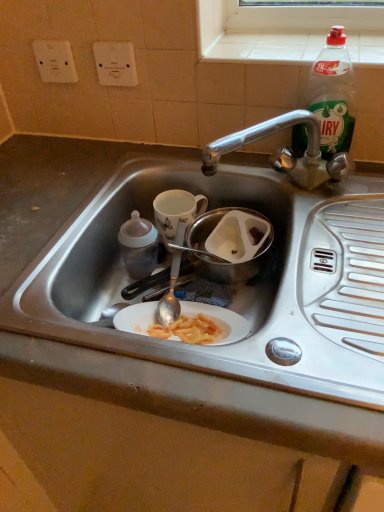
Question: Is white plastic socket at upper center, which is the first electric outlet in right-to-left order, positioned with its back to green plastic bottle at upper right, the first bottle in the right-to-left sequence?

Choices:
 (A) no
 (B) yes

Answer: (A)

Question: From the image's perspective, is white plastic socket at upper center, arranged as the 2th electric outlet when viewed from the left, located above green plastic bottle at upper right, the first bottle in the right-to-left sequence?

Choices:
 (A) no
 (B) yes

Answer: (B)

Question: From the image's perspective, does white plastic socket at upper center, which is the first electric outlet in right-to-left order, appear lower than green plastic bottle at upper right, the first bottle in the right-to-left sequence?

Choices:
 (A) no
 (B) yes

Answer: (A)

Question: Is white plastic socket at upper center, which is the first electric outlet in right-to-left order, oriented towards green plastic bottle at upper right, placed as the 2th bottle when sorted from bottom to top?

Choices:
 (A) no
 (B) yes

Answer: (A)

Question: Is white plastic socket at upper center, arranged as the 2th electric outlet when viewed from the left, shorter than green plastic bottle at upper right, which ranks as the first bottle in top-to-bottom order?

Choices:
 (A) no
 (B) yes

Answer: (B)

Question: From the image's perspective, is white plastic electric outlet at upper left, acting as the second electric outlet starting from the right, located above or below translucent plastic baby bottle at left, the 2th bottle when ordered from top to bottom?

Choices:
 (A) above
 (B) below

Answer: (A)

Question: Is white plastic electric outlet at upper left, which is the 1th electric outlet in left-to-right order, to the left or to the right of translucent plastic baby bottle at left, the 2th bottle viewed from the right, in the image?

Choices:
 (A) left
 (B) right

Answer: (A)

Question: Considering the positions of white plastic electric outlet at upper left, which is the 1th electric outlet in left-to-right order, and translucent plastic baby bottle at left, the 2th bottle when ordered from top to bottom, in the image, is white plastic electric outlet at upper left, which is the 1th electric outlet in left-to-right order, wider or thinner than translucent plastic baby bottle at left, the 2th bottle when ordered from top to bottom,?

Choices:
 (A) thin
 (B) wide

Answer: (A)

Question: From a real-world perspective, is white plastic electric outlet at upper left, acting as the second electric outlet starting from the right, positioned above or below translucent plastic baby bottle at left, the first bottle positioned from the bottom?

Choices:
 (A) below
 (B) above

Answer: (B)

Question: Relative to white plastic socket at upper center, which is the first electric outlet in right-to-left order, is metallic stainless steel bowl at center in front or behind?

Choices:
 (A) front
 (B) behind

Answer: (A)

Question: From a real-world perspective, is metallic stainless steel bowl at center physically located above or below white plastic socket at upper center, arranged as the 2th electric outlet when viewed from the left?

Choices:
 (A) below
 (B) above

Answer: (A)

Question: Is point (201, 223) closer or farther from the camera than point (99, 67)?

Choices:
 (A) farther
 (B) closer

Answer: (A)

Question: In terms of height, does metallic stainless steel bowl at center look taller or shorter compared to white plastic socket at upper center, arranged as the 2th electric outlet when viewed from the left?

Choices:
 (A) short
 (B) tall

Answer: (A)

Question: Considering the positions of white plastic socket at upper center, which is the first electric outlet in right-to-left order, and white plastic electric outlet at upper left, acting as the second electric outlet starting from the right, in the image, is white plastic socket at upper center, which is the first electric outlet in right-to-left order, wider or thinner than white plastic electric outlet at upper left, acting as the second electric outlet starting from the right,?

Choices:
 (A) thin
 (B) wide

Answer: (B)

Question: From the image's perspective, is white plastic socket at upper center, which is the first electric outlet in right-to-left order, above or below white plastic electric outlet at upper left, acting as the second electric outlet starting from the right?

Choices:
 (A) below
 (B) above

Answer: (A)